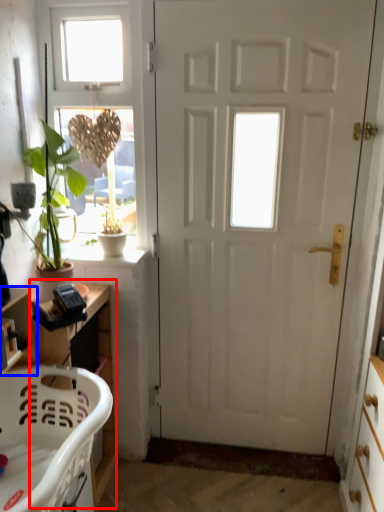
Question: Which object is further to the camera taking this photo, cabinetry (highlighted by a red box) or shelf (highlighted by a blue box)?

Choices:
 (A) cabinetry
 (B) shelf

Answer: (A)